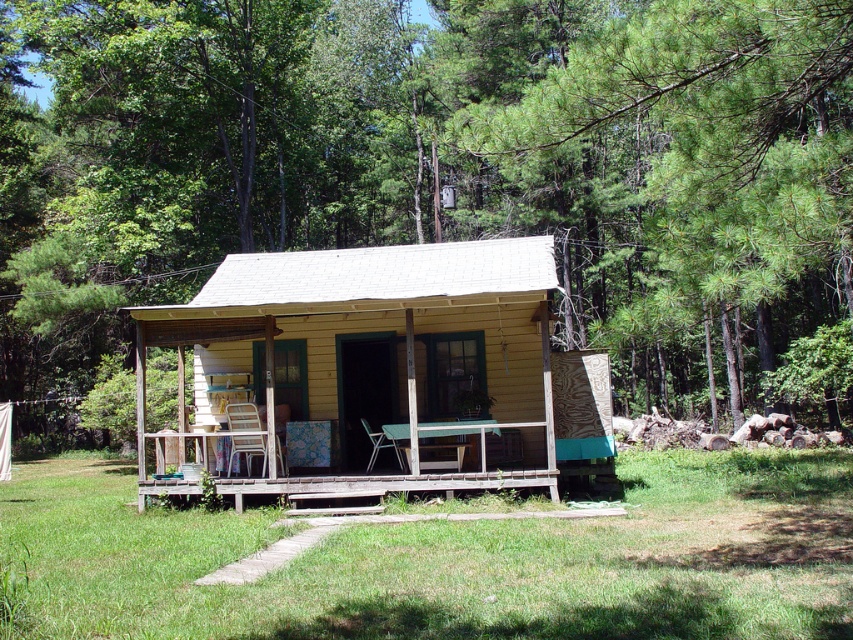
Question: Is green leafy tree at upper center smaller than wooden porch at center?

Choices:
 (A) yes
 (B) no

Answer: (B)

Question: Which point is closer to the camera?

Choices:
 (A) wooden porch at center
 (B) yellow wood log cabin at center
 (C) green leafy tree at upper center

Answer: (C)

Question: Which point is farther to the camera?

Choices:
 (A) (364, 424)
 (B) (241, 422)

Answer: (A)

Question: Considering the real-world distances, which object is farthest from the wooden porch at center?

Choices:
 (A) metallic silver chair at center
 (B) yellow wood log cabin at center
 (C) metallic mesh chair at center
 (D) green leafy tree at upper center

Answer: (D)

Question: Where is metallic mesh chair at center located in relation to metallic silver chair at center in the image?

Choices:
 (A) above
 (B) below

Answer: (A)

Question: Is green leafy tree at upper center to the left of yellow wood log cabin at center from the viewer's perspective?

Choices:
 (A) no
 (B) yes

Answer: (B)